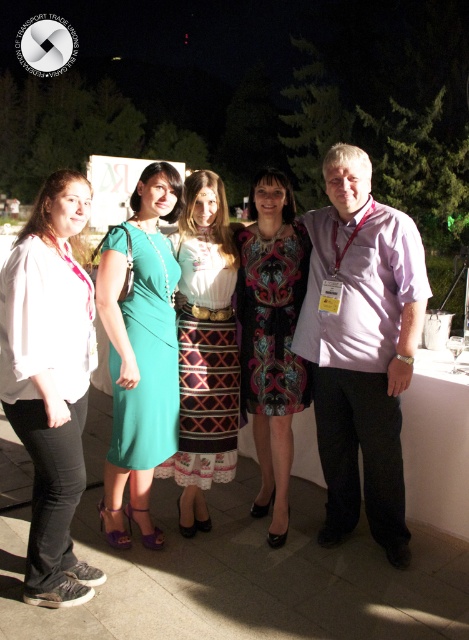
Measure the distance between point (45,278) and camera.

They are 2.31 meters apart.

In the scene shown: Can you confirm if matte white shirt at left is bigger than teal fabric dress at center?

No, matte white shirt at left is not bigger than teal fabric dress at center.

Who is more distant from viewer, (x=43, y=196) or (x=156, y=378)?

Point (x=156, y=378)

Where is `matte white shirt at left`? This screenshot has width=469, height=640. matte white shirt at left is located at coordinates (51, 380).

Is patterned fabric skirt at center thinner than printed fabric dress at center?

In fact, patterned fabric skirt at center might be wider than printed fabric dress at center.

Is patterned fabric skirt at center to the left of printed fabric dress at center from the viewer's perspective?

Yes, patterned fabric skirt at center is to the left of printed fabric dress at center.

In order to click on patterned fabric skirt at center in this screenshot , I will do `click(204, 349)`.

The height and width of the screenshot is (640, 469). Find the location of `patterned fabric skirt at center`. patterned fabric skirt at center is located at coordinates [x=204, y=349].

Is matte white shirt at left wider than patterned fabric skirt at center?

No.

Describe the element at coordinates (51, 380) in the screenshot. The image size is (469, 640). I see `matte white shirt at left` at that location.

Between point (66, 444) and point (183, 426), which one is positioned behind?

Positioned behind is point (183, 426).

I want to click on matte white shirt at left, so click(x=51, y=380).